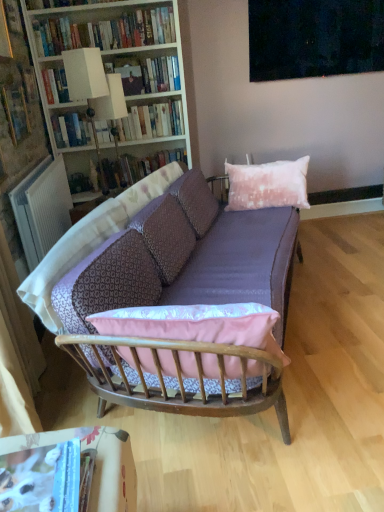
Where is `free space above white paper book at lower left, acting as the 6th book starting from the top (from a real-world perspective)`? free space above white paper book at lower left, acting as the 6th book starting from the top (from a real-world perspective) is located at coordinates (37, 480).